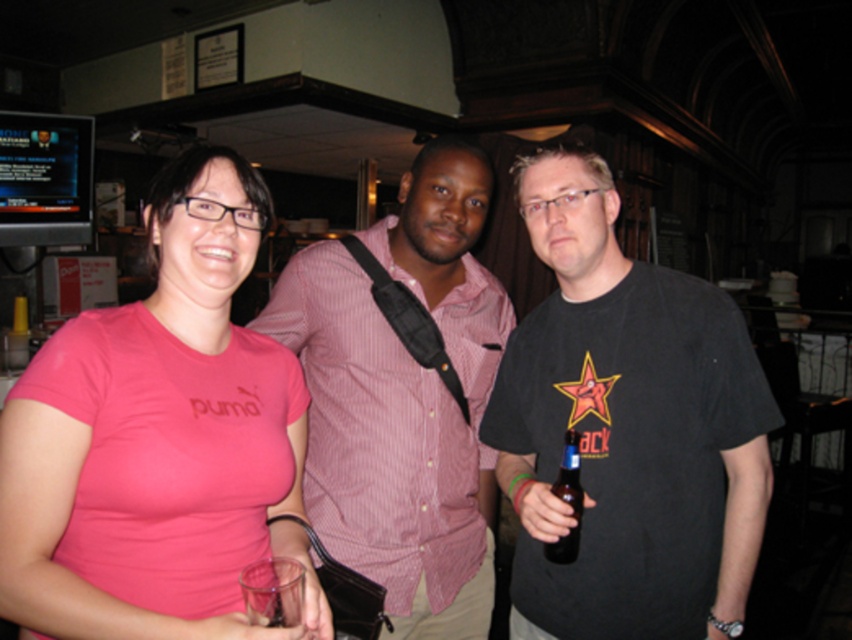
Does black matte t-shirt at center have a lesser width compared to pink striped shirt at center?

Correct, black matte t-shirt at center's width is less than pink striped shirt at center's.

Between black matte t-shirt at center and pink striped shirt at center, which one is positioned lower?

pink striped shirt at center is lower down.

Who is more forward, (674, 618) or (463, 456)?

Point (674, 618) is in front.

This screenshot has width=852, height=640. Find the location of `black matte t-shirt at center`. black matte t-shirt at center is located at coordinates (626, 428).

Does black matte t-shirt at center have a smaller size compared to pink matte t-shirt at center?

Actually, black matte t-shirt at center might be larger than pink matte t-shirt at center.

Is black matte t-shirt at center to the right of pink matte t-shirt at center from the viewer's perspective?

Correct, you'll find black matte t-shirt at center to the right of pink matte t-shirt at center.

Who is more forward, (597, 410) or (263, 189)?

Point (263, 189) is in front.

In order to click on black matte t-shirt at center in this screenshot , I will do `click(626, 428)`.

Measure the distance between transparent plastic cup at lower left and camera.

A distance of 39.26 inches exists between transparent plastic cup at lower left and camera.

From the picture: Who is shorter, transparent plastic cup at lower left or brown glass bottle at center?

transparent plastic cup at lower left is shorter.

Describe the element at coordinates (273, 592) in the screenshot. I see `transparent plastic cup at lower left` at that location.

This screenshot has height=640, width=852. I want to click on transparent plastic cup at lower left, so click(x=273, y=592).